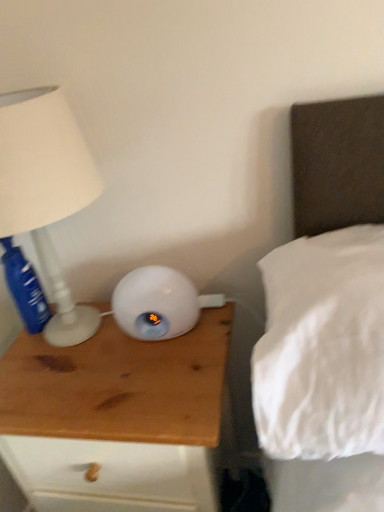
Question: Can you confirm if white matte lamp at left is bigger than blue plastic bottle at left?

Choices:
 (A) yes
 (B) no

Answer: (A)

Question: Is white matte lamp at left positioned behind blue plastic bottle at left?

Choices:
 (A) yes
 (B) no

Answer: (B)

Question: Considering the relative sizes of white matte lamp at left and blue plastic bottle at left in the image provided, is white matte lamp at left shorter than blue plastic bottle at left?

Choices:
 (A) no
 (B) yes

Answer: (A)

Question: Is white matte lamp at left smaller than blue plastic bottle at left?

Choices:
 (A) yes
 (B) no

Answer: (B)

Question: Is blue plastic bottle at left at the back of white matte lamp at left?

Choices:
 (A) yes
 (B) no

Answer: (A)

Question: Considering the relative positions of white matte lamp at left and blue plastic bottle at left in the image provided, is white matte lamp at left in front of blue plastic bottle at left?

Choices:
 (A) no
 (B) yes

Answer: (B)

Question: Does white soft pillow at upper right turn towards blue plastic bottle at left?

Choices:
 (A) no
 (B) yes

Answer: (A)

Question: Does white soft pillow at upper right have a lesser height compared to blue plastic bottle at left?

Choices:
 (A) no
 (B) yes

Answer: (A)

Question: Does white soft pillow at upper right have a greater height compared to blue plastic bottle at left?

Choices:
 (A) no
 (B) yes

Answer: (B)

Question: Is white soft pillow at upper right positioned with its back to blue plastic bottle at left?

Choices:
 (A) yes
 (B) no

Answer: (B)

Question: Is white soft pillow at upper right far away from blue plastic bottle at left?

Choices:
 (A) no
 (B) yes

Answer: (A)

Question: Can you confirm if white soft pillow at upper right is bigger than blue plastic bottle at left?

Choices:
 (A) no
 (B) yes

Answer: (B)

Question: Is white matte lamp at left further to the viewer compared to wooden nightstand at left?

Choices:
 (A) yes
 (B) no

Answer: (B)